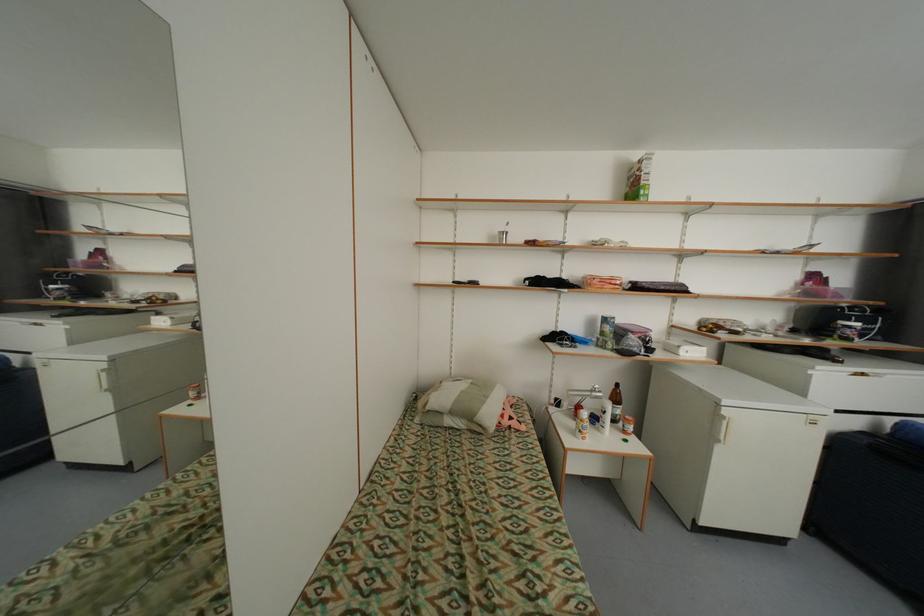
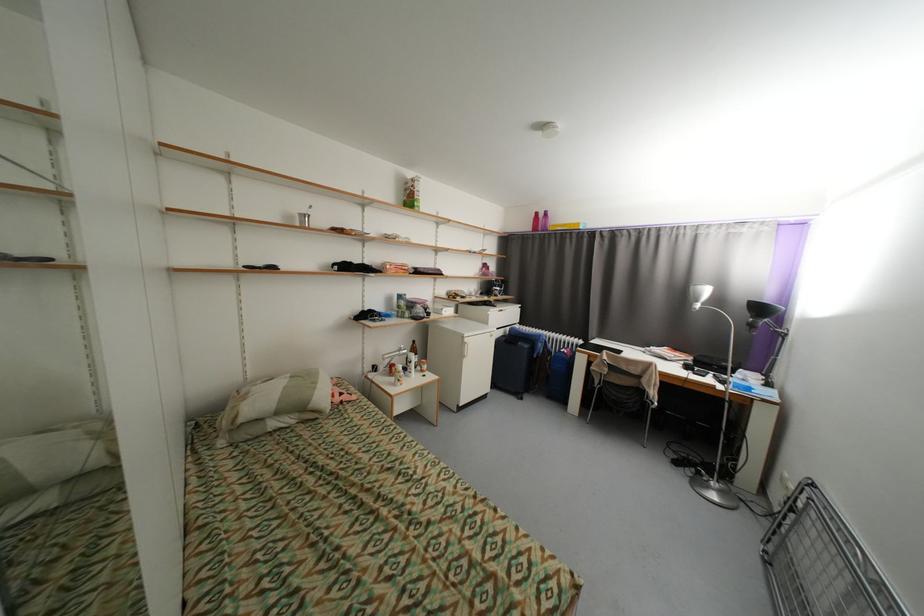
Find the pixel in the second image that matches pixel 732 413 in the first image.

(472, 341)